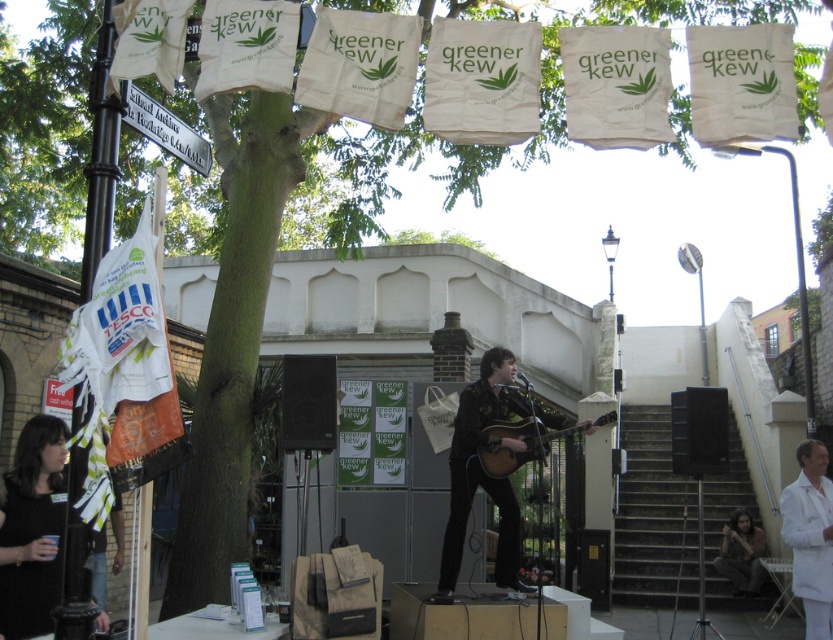
Can you confirm if black fabric shirt at lower left is smaller than acoustic wood guitar at center?

Indeed, black fabric shirt at lower left has a smaller size compared to acoustic wood guitar at center.

Which of these two, black fabric shirt at lower left or acoustic wood guitar at center, stands taller?

black fabric shirt at lower left is taller.

Which is behind, point (13, 627) or point (486, 461)?

Positioned behind is point (486, 461).

Where is `black fabric shirt at lower left`? black fabric shirt at lower left is located at coordinates (33, 529).

Consider the image. Is matte black guitar at center closer to the viewer compared to white lab coat at lower right?

Yes, matte black guitar at center is in front of white lab coat at lower right.

Consider the image. Can you confirm if matte black guitar at center is positioned above white lab coat at lower right?

Yes, matte black guitar at center is above white lab coat at lower right.

You are a GUI agent. You are given a task and a screenshot of the screen. Output one action in this format:
    pyautogui.click(x=<x>, y=<y>)
    Task: Click on the matte black guitar at center
    The image size is (833, 640).
    Given the screenshot: What is the action you would take?
    pyautogui.click(x=482, y=472)

Is black fabric shirt at lower left shorter than brown hair at lower right?

Incorrect, black fabric shirt at lower left's height does not fall short of brown hair at lower right's.

Is point (38, 563) closer to viewer compared to point (742, 515)?

Yes, point (38, 563) is in front of point (742, 515).

Identify the location of black fabric shirt at lower left. This screenshot has height=640, width=833. (33, 529).